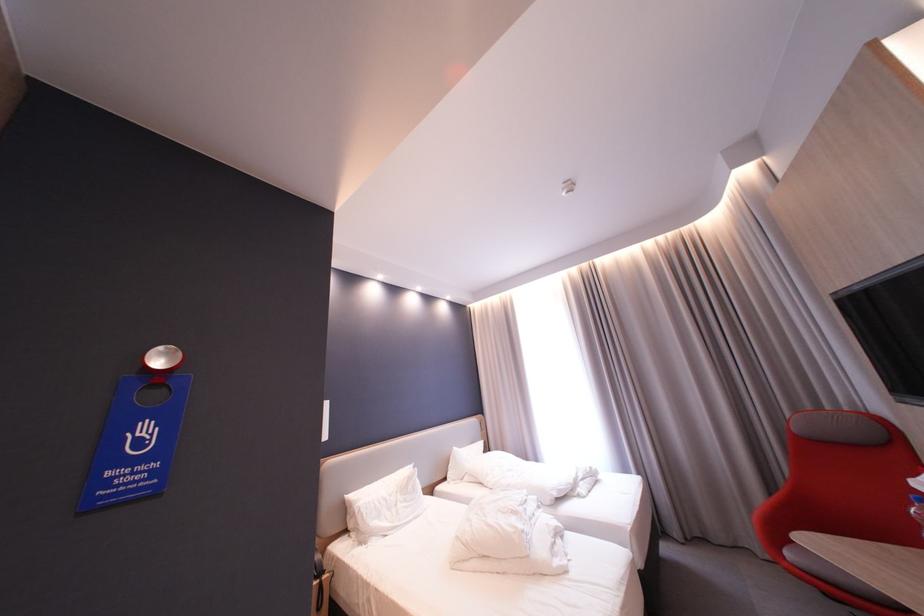
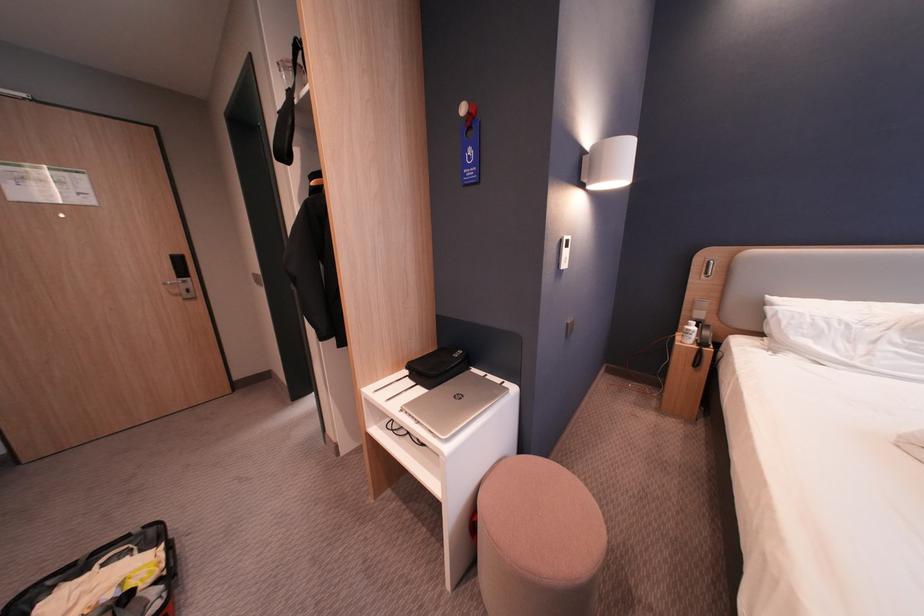
First-person continuous shooting, in which direction is the camera rotating?

The camera rotated toward left-down.